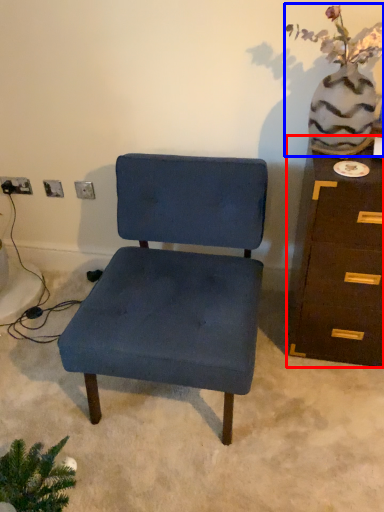
Question: Among these objects, which one is nearest to the camera, chest of drawers (highlighted by a red box) or floral arrangement (highlighted by a blue box)?

Choices:
 (A) chest of drawers
 (B) floral arrangement

Answer: (B)